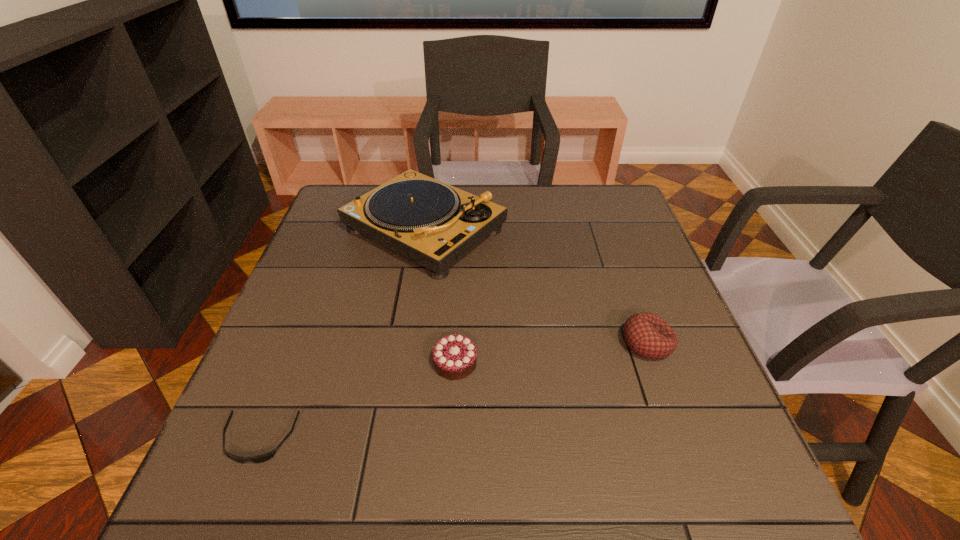
Image resolution: width=960 pixels, height=540 pixels. In order to click on object that is at the far edge in this screenshot , I will do `click(428, 221)`.

The width and height of the screenshot is (960, 540). I want to click on object situated at the near edge, so click(x=262, y=458).

Locate an element on the screen. record player that is at the left edge is located at coordinates (x=428, y=221).

The height and width of the screenshot is (540, 960). In order to click on sunglasses that is positioned at the left edge in this screenshot , I will do `click(262, 458)`.

Where is `object positioned at the right edge`? This screenshot has width=960, height=540. object positioned at the right edge is located at coordinates (647, 335).

Image resolution: width=960 pixels, height=540 pixels. I want to click on object that is at the far left corner, so click(x=428, y=221).

Locate an element on the screen. The image size is (960, 540). object at the near left corner is located at coordinates [262, 458].

Image resolution: width=960 pixels, height=540 pixels. Identify the location of vacant point at the far edge. (517, 192).

Find the location of `vacant space at the near edge`. vacant space at the near edge is located at coordinates (520, 495).

The height and width of the screenshot is (540, 960). Identify the location of vacant point at the left edge. (307, 355).